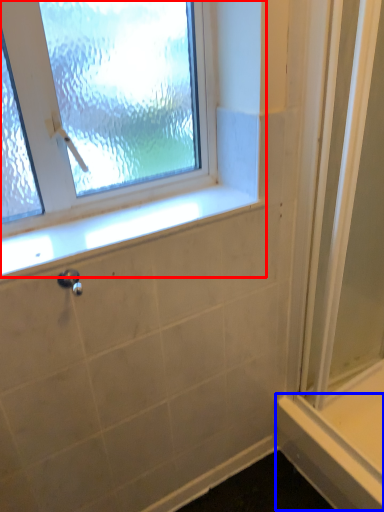
Question: Which object appears closest to the camera in this image, window (highlighted by a red box) or ledge (highlighted by a blue box)?

Choices:
 (A) window
 (B) ledge

Answer: (A)